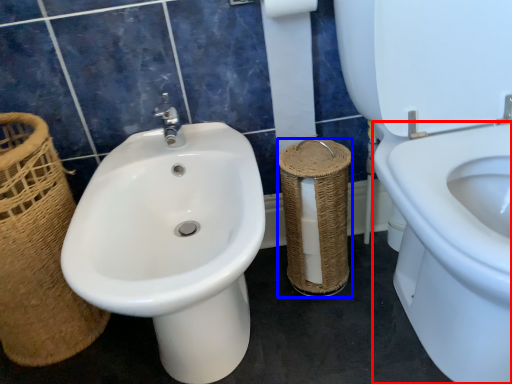
Question: Which object is closer to the camera taking this photo, bidet (highlighted by a red box) or basket container (highlighted by a blue box)?

Choices:
 (A) bidet
 (B) basket container

Answer: (A)